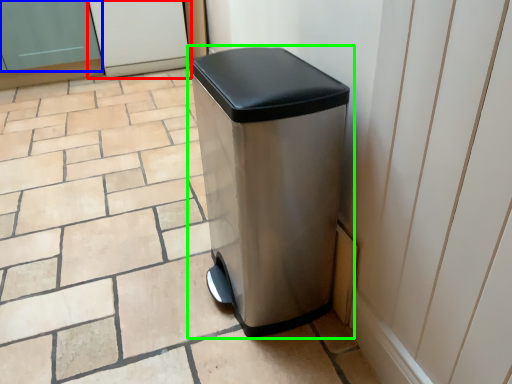
Question: Which is nearer to the screen door (highlighted by a red box)? screen door (highlighted by a blue box) or waste container (highlighted by a green box).

Choices:
 (A) screen door
 (B) waste container

Answer: (A)